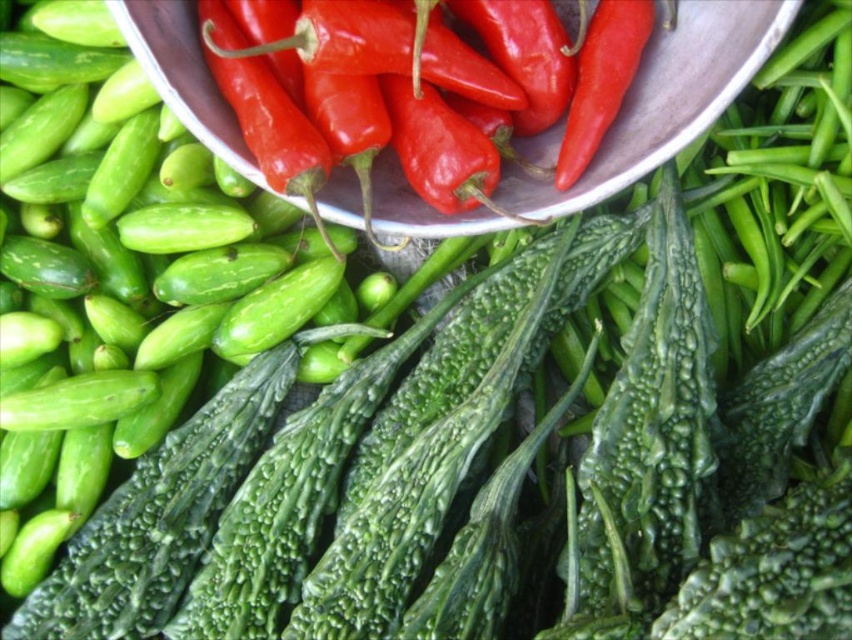
Question: Among these objects, which one is farthest from the camera?

Choices:
 (A) metallic bowl at upper center
 (B) green matte cucumber at left

Answer: (B)

Question: Can you confirm if green matte cucumber at left is positioned to the right of metallic bowl at upper center?

Choices:
 (A) yes
 (B) no

Answer: (B)

Question: Is green matte cucumber at left closer to camera compared to metallic bowl at upper center?

Choices:
 (A) no
 (B) yes

Answer: (A)

Question: Does green matte cucumber at left lie in front of metallic bowl at upper center?

Choices:
 (A) no
 (B) yes

Answer: (A)